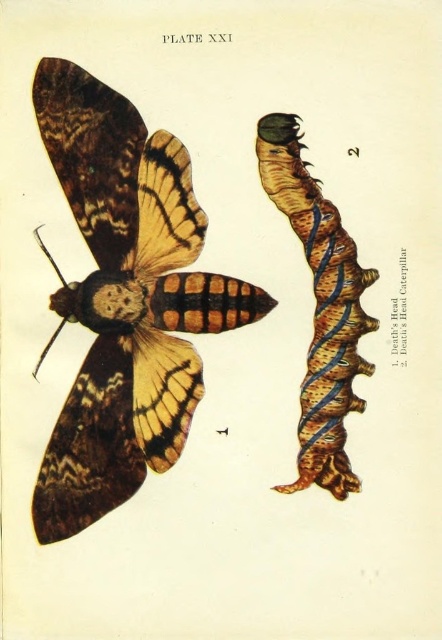
Which is more to the left, brown textured moth at left or brown textured caterpillar at right?

brown textured moth at left is more to the left.

Does point (137, 380) come farther from viewer compared to point (292, 132)?

Yes, it is.

Where is `brown textured moth at left`? Image resolution: width=442 pixels, height=640 pixels. brown textured moth at left is located at coordinates (125, 300).